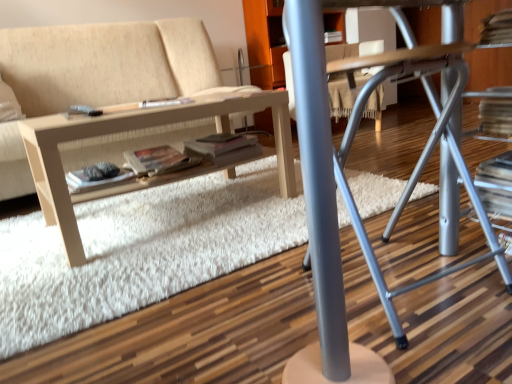
The width and height of the screenshot is (512, 384). I want to click on vacant area that is in front of light wood/texture table at lower left, so click(x=114, y=270).